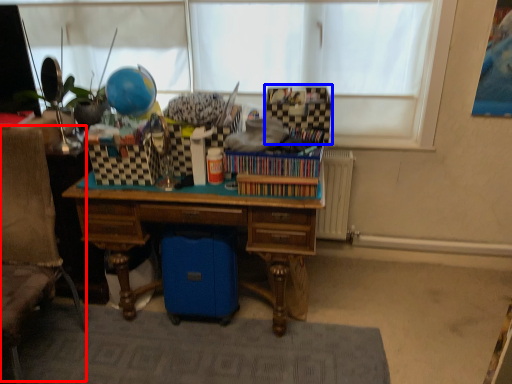
Question: Which of the following is the farthest to the observer, swivel chair (highlighted by a red box) or storage box (highlighted by a blue box)?

Choices:
 (A) swivel chair
 (B) storage box

Answer: (B)